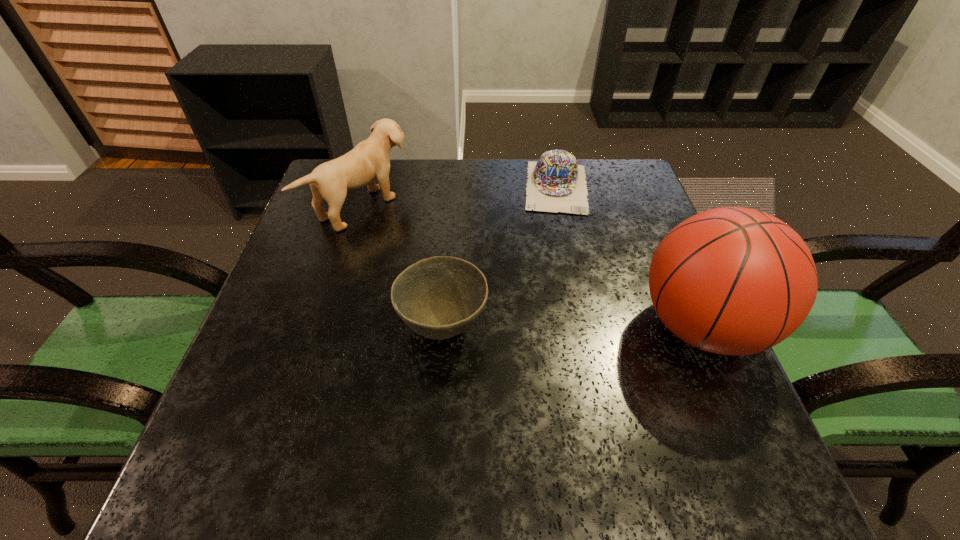
Image resolution: width=960 pixels, height=540 pixels. I want to click on object that can be found as the third closest to the puppy, so click(x=733, y=281).

The width and height of the screenshot is (960, 540). What are the coordinates of `blank area in the image that satisfies the following two spatial constraints: 1. on the front side of the basketball; 2. on the left side of the third tallest object` in the screenshot? It's located at (444, 327).

The height and width of the screenshot is (540, 960). I want to click on vacant region that satisfies the following two spatial constraints: 1. on the front side of the basketball; 2. on the right side of the leftmost object, so click(x=329, y=327).